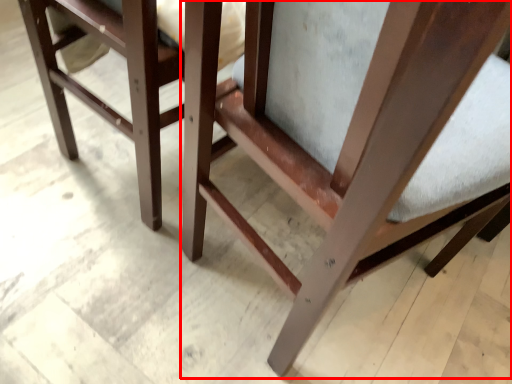
Question: From the image's perspective, where is chair (annotated by the red box) located in relation to furniture in the image?

Choices:
 (A) below
 (B) above

Answer: (A)